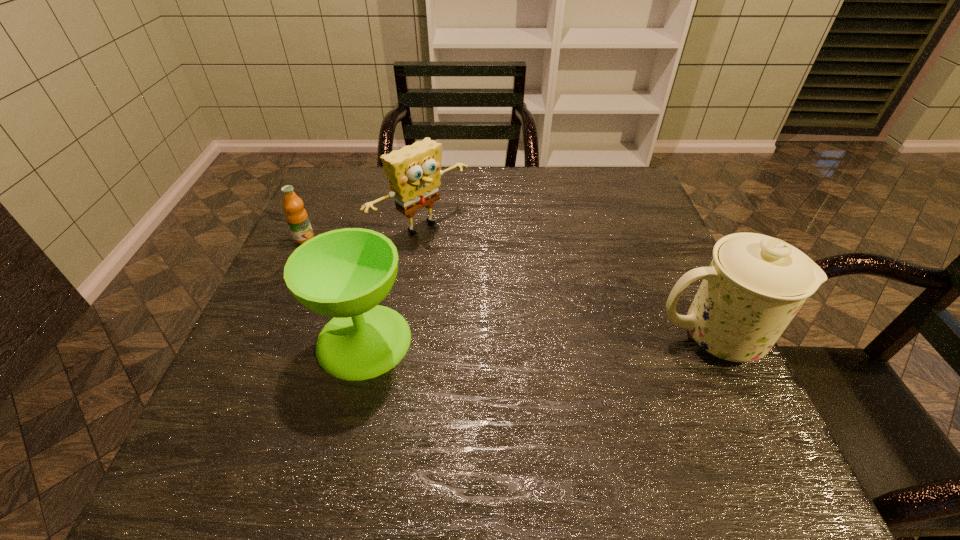
Where is `free spot at the far left corner of the desktop`? This screenshot has height=540, width=960. free spot at the far left corner of the desktop is located at coordinates (319, 212).

In the image, there is a desktop. What are the coordinates of `blank space at the far right corner` in the screenshot? It's located at (626, 184).

Locate an element on the screen. vacant area that lies between the sponge and the rightmost object is located at coordinates (569, 283).

I want to click on free area in between the wineglass and the chinaware, so click(x=540, y=339).

I want to click on empty space that is in between the sponge and the chinaware, so click(569, 283).

This screenshot has height=540, width=960. I want to click on object identified as the closest to the rightmost object, so point(414,172).

At what (x,y) coordinates should I click in order to perform the action: click on object that is the nearest to the shortest object. Please return your answer as a coordinate pair (x, y). The height and width of the screenshot is (540, 960). Looking at the image, I should click on (414, 172).

You are a GUI agent. You are given a task and a screenshot of the screen. Output one action in this format:
    pyautogui.click(x=<x>, y=<y>)
    Task: Click on the free space that satisfies the following two spatial constraints: 1. on the back side of the wineglass; 2. on the spout of the rightmost object
    The height and width of the screenshot is (540, 960).
    Given the screenshot: What is the action you would take?
    pyautogui.click(x=365, y=338)

This screenshot has height=540, width=960. In order to click on vacant space that satisfies the following two spatial constraints: 1. on the back side of the leftmost object; 2. on the left side of the sponge in this screenshot , I will do `click(309, 228)`.